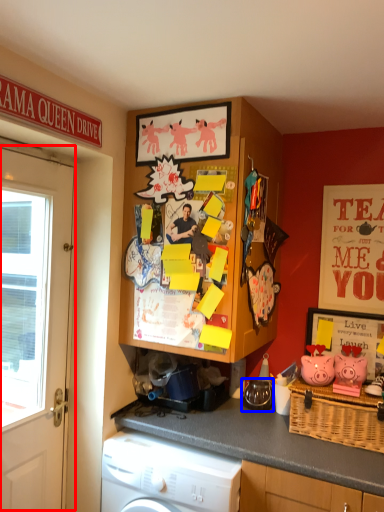
Question: Among these objects, which one is farthest to the camera, door (highlighted by a red box) or appliance (highlighted by a blue box)?

Choices:
 (A) door
 (B) appliance

Answer: (B)